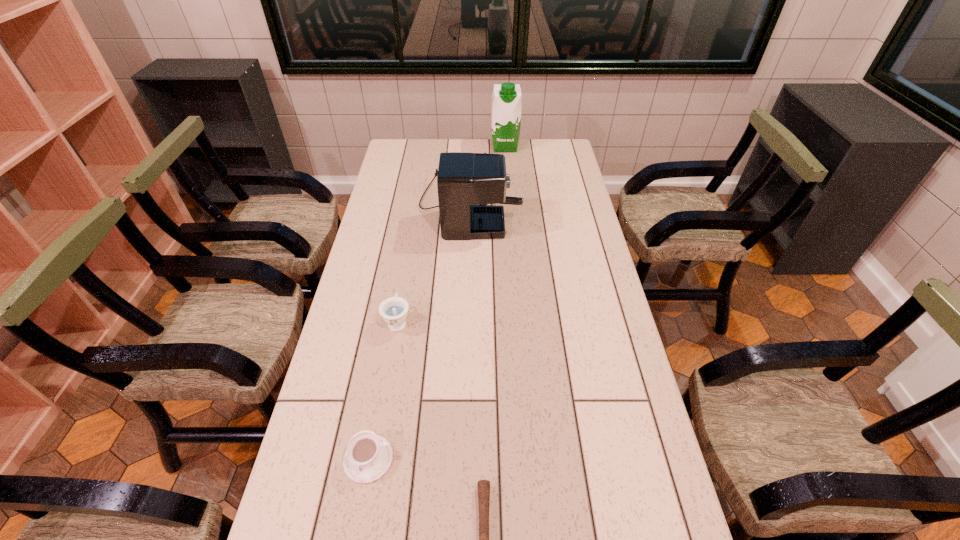
Locate an element on the screen. The height and width of the screenshot is (540, 960). the farthest object is located at coordinates (506, 98).

Identify the location of the fourth shortest object. (467, 182).

Identify the location of coffee maker. The width and height of the screenshot is (960, 540). (467, 182).

The height and width of the screenshot is (540, 960). Identify the location of the third nearest object. (394, 310).

Where is `the farther teacup`? the farther teacup is located at coordinates (394, 310).

The width and height of the screenshot is (960, 540). Identify the location of the nearer teacup. (368, 456).

Find the location of a particular element. The image size is (960, 540). the shorter teacup is located at coordinates (368, 456).

At what (x,y) coordinates should I click in order to perform the action: click on vacant region located on the front-facing side of the soya milk. Please return your answer as a coordinate pair (x, y). Looking at the image, I should click on (507, 171).

I want to click on free space located on the front-facing side of the second farthest object, so click(x=544, y=204).

Image resolution: width=960 pixels, height=540 pixels. Find the location of `vacant space positioned 0.180m on the side of the third farthest object with the handle`. vacant space positioned 0.180m on the side of the third farthest object with the handle is located at coordinates (407, 266).